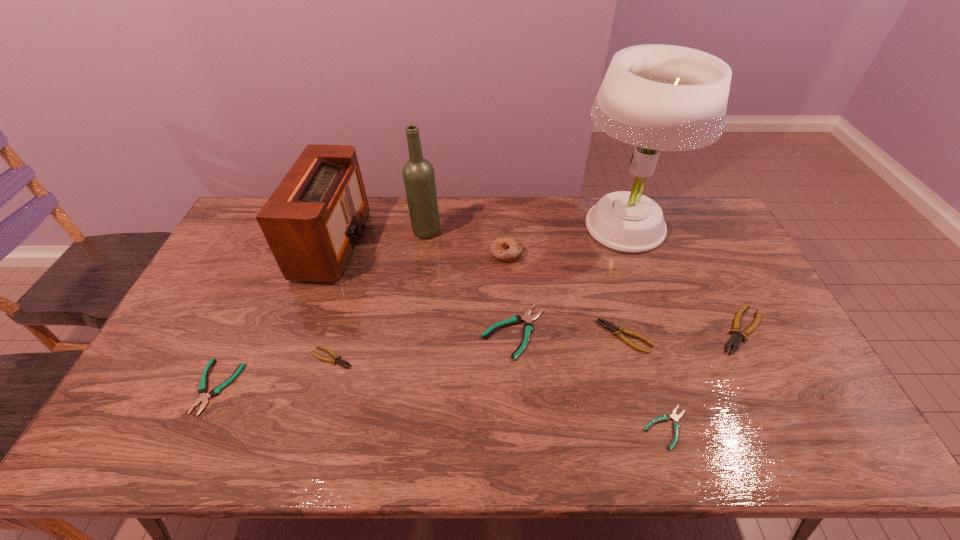
At what (x,y) coordinates should I click in order to perform the action: click on the second smallest yellow pliers. Please return your answer as a coordinate pair (x, y). This screenshot has width=960, height=540. Looking at the image, I should click on pyautogui.click(x=605, y=324).

Identify the location of the leftmost pliers. The height and width of the screenshot is (540, 960). (202, 389).

Identify the location of the second smallest teal pliers. (202, 389).

At what (x,y) coordinates should I click in order to perform the action: click on the leftmost yellow pliers. Please return your answer as a coordinate pair (x, y). Looking at the image, I should click on (337, 359).

The height and width of the screenshot is (540, 960). In order to click on the smallest yellow pliers in this screenshot , I will do [337, 359].

Identify the location of the shortest object. (676, 425).

This screenshot has height=540, width=960. What are the coordinates of `the smallest teal pliers` in the screenshot? It's located at (676, 425).

The image size is (960, 540). In order to click on vacant position located 0.070m on the front-facing side of the white lamp in this screenshot , I will do `click(641, 280)`.

Where is `free space located on the front of the fourth object from left to right`? The width and height of the screenshot is (960, 540). free space located on the front of the fourth object from left to right is located at coordinates (416, 311).

This screenshot has height=540, width=960. I want to click on vacant space situated 0.060m on the front of the radio receiver, so click(313, 301).